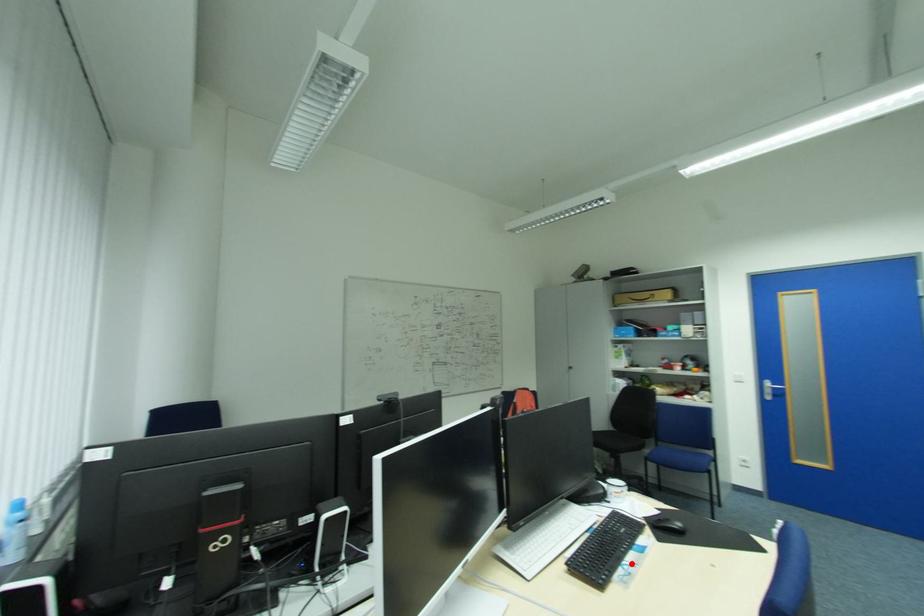
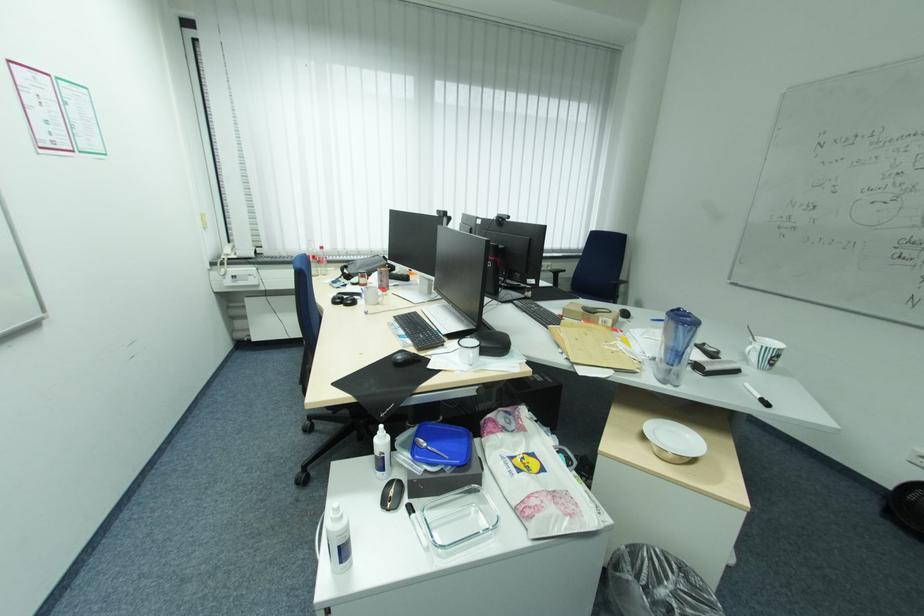
Where in the second image is the point corresponding to the highlighted location from the first image?

(407, 329)